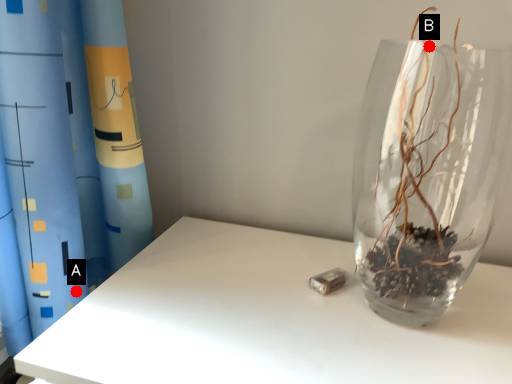
Question: Two points are circled on the image, labeled by A and B beside each circle. Which point appears closest to the camera in this image?

Choices:
 (A) A is closer
 (B) B is closer

Answer: (A)